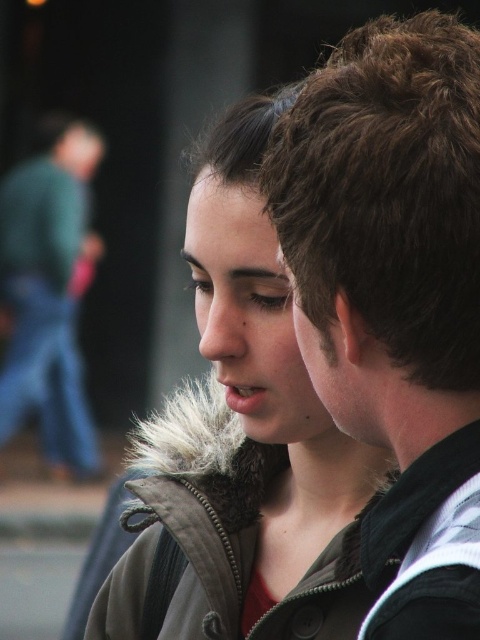
Who is positioned more to the right, brown hair at upper right or gray fur-lined jacket at center?

From the viewer's perspective, brown hair at upper right appears more on the right side.

Can you confirm if brown hair at upper right is positioned to the left of gray fur-lined jacket at center?

No, brown hair at upper right is not to the left of gray fur-lined jacket at center.

What do you see at coordinates (395, 296) in the screenshot?
I see `brown hair at upper right` at bounding box center [395, 296].

Identify the location of brown hair at upper right. (395, 296).

Is gray fur-lined jacket at center to the right of green denim jeans at left from the viewer's perspective?

Indeed, gray fur-lined jacket at center is positioned on the right side of green denim jeans at left.

Is gray fur-lined jacket at center below green denim jeans at left?

Indeed, gray fur-lined jacket at center is positioned under green denim jeans at left.

Locate an element on the screen. This screenshot has height=640, width=480. gray fur-lined jacket at center is located at coordinates click(243, 436).

Between brown hair at upper right and green denim jeans at left, which one is positioned lower?

brown hair at upper right is below.

Does brown hair at upper right have a greater width compared to green denim jeans at left?

In fact, brown hair at upper right might be narrower than green denim jeans at left.

Is point (432, 506) behind point (43, 333)?

That is False.

Locate an element on the screen. brown hair at upper right is located at coordinates (395, 296).